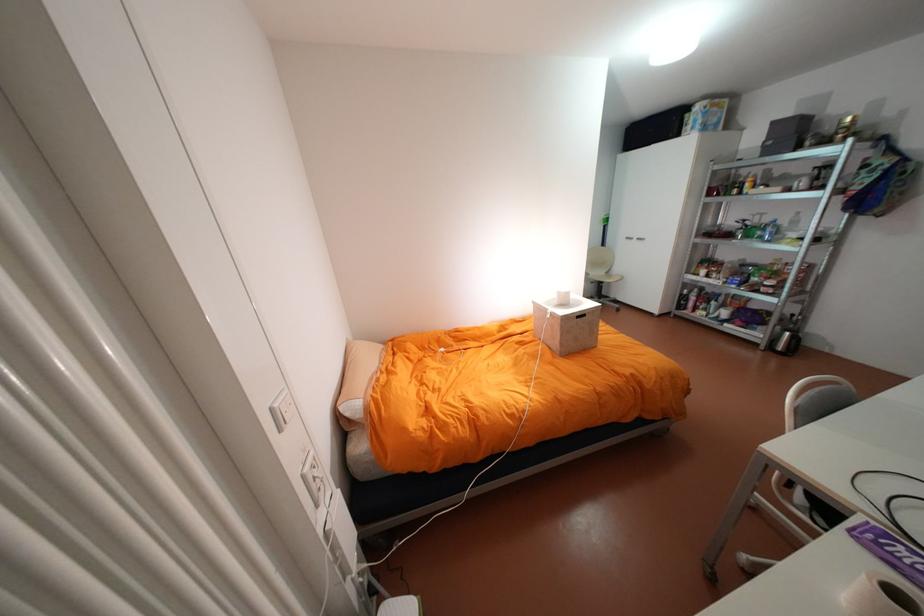
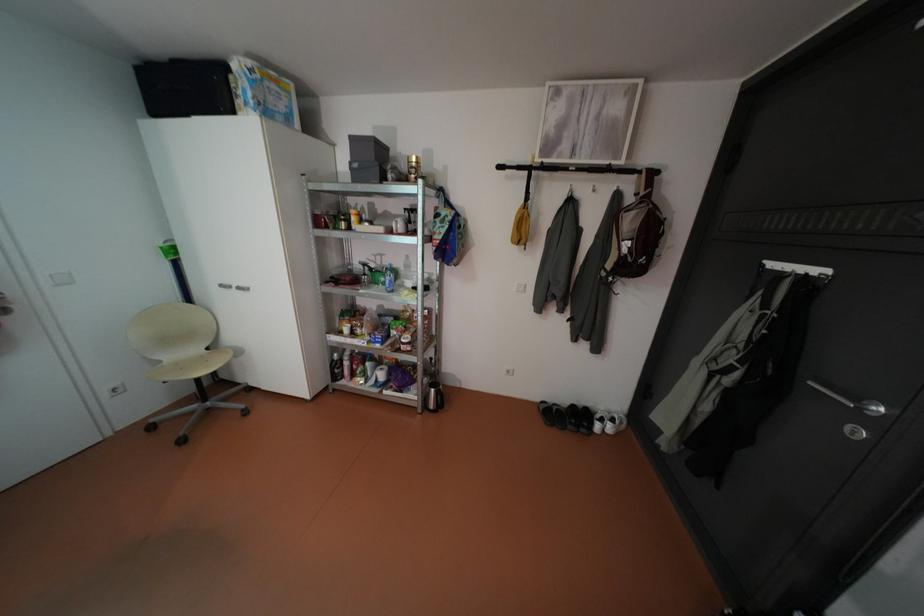
Find the pixel in the second image that matches point 756,236 in the first image.

(383, 282)